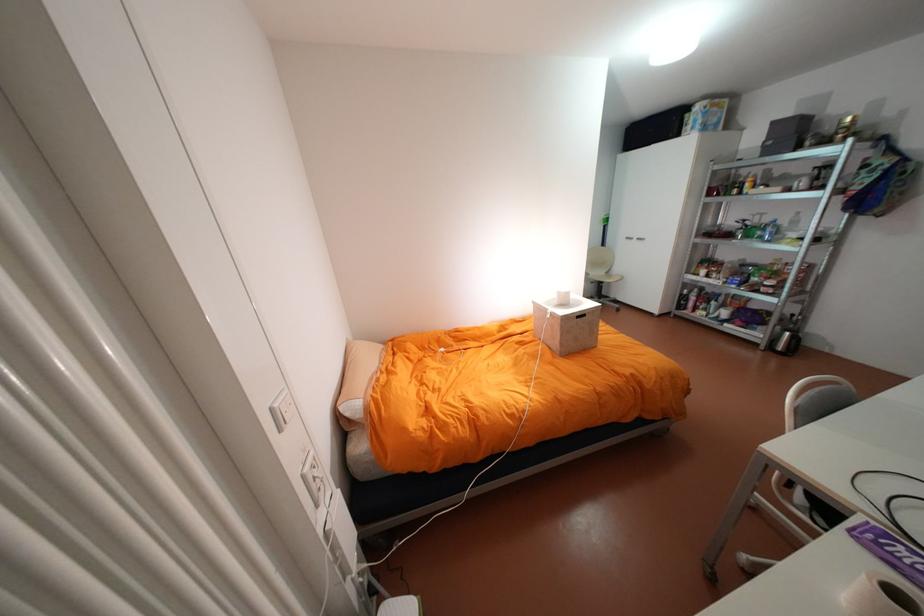
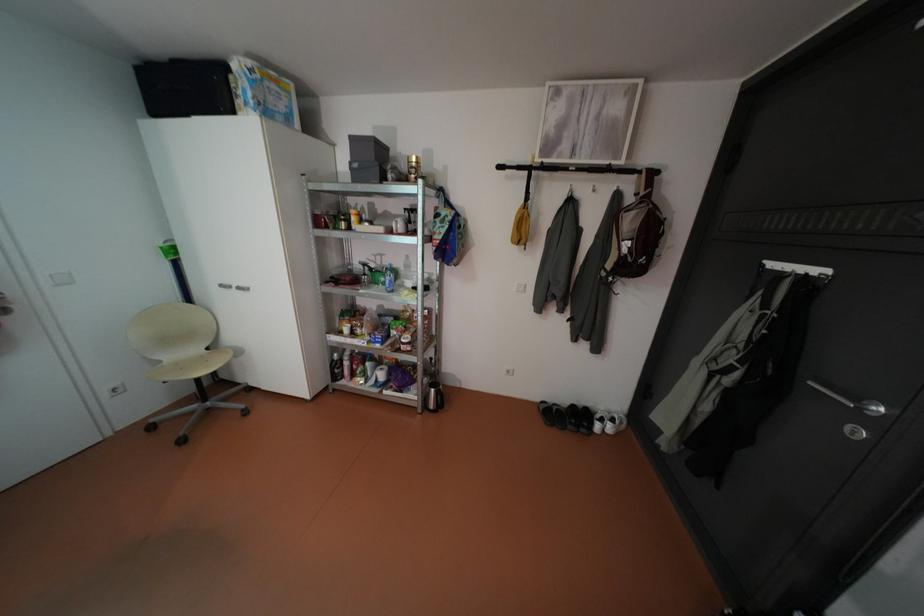
Find the pixel in the second image that matches point 756,236 in the first image.

(383, 282)